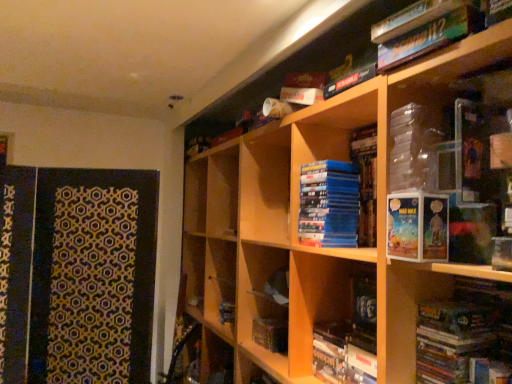
Question: Does wooden bookcase at upper right lie behind matte black book at lower right, placed as the 3th book when sorted from top to bottom?

Choices:
 (A) yes
 (B) no

Answer: (B)

Question: From a real-world perspective, is wooden bookcase at upper right on top of matte black book at lower right, placed as the 3th book when sorted from top to bottom?

Choices:
 (A) no
 (B) yes

Answer: (B)

Question: Could you tell me if wooden bookcase at upper right is turned towards matte black book at lower right, placed as the 3th book when sorted from top to bottom?

Choices:
 (A) no
 (B) yes

Answer: (B)

Question: Does wooden bookcase at upper right have a greater height compared to matte black book at lower right, which ranks as the second book in bottom-to-top order?

Choices:
 (A) yes
 (B) no

Answer: (A)

Question: Is wooden bookcase at upper right wider than matte black book at lower right, placed as the 3th book when sorted from top to bottom?

Choices:
 (A) yes
 (B) no

Answer: (A)

Question: From a real-world perspective, is wooden bookcase at upper right positioned above or below matte cardboard book at center-right?

Choices:
 (A) below
 (B) above

Answer: (A)

Question: Choose the correct answer: Is wooden bookcase at upper right inside matte cardboard book at center-right or outside it?

Choices:
 (A) outside
 (B) inside

Answer: (A)

Question: Based on their positions, is wooden bookcase at upper right located to the left or right of matte cardboard book at center-right?

Choices:
 (A) left
 (B) right

Answer: (A)

Question: In the image, is wooden bookcase at upper right positioned in front of or behind matte cardboard book at center-right?

Choices:
 (A) front
 (B) behind

Answer: (A)

Question: Considering the positions of green cardboard book at upper right, acting as the 4th book starting from the bottom, and wooden bookcase at upper right in the image, is green cardboard book at upper right, acting as the 4th book starting from the bottom, taller or shorter than wooden bookcase at upper right?

Choices:
 (A) tall
 (B) short

Answer: (B)

Question: Looking at the image, does green cardboard book at upper right, acting as the 4th book starting from the bottom, seem bigger or smaller compared to wooden bookcase at upper right?

Choices:
 (A) small
 (B) big

Answer: (A)

Question: Which is correct: green cardboard book at upper right, acting as the 4th book starting from the bottom, is inside wooden bookcase at upper right, or outside of it?

Choices:
 (A) inside
 (B) outside

Answer: (B)

Question: In the image, is green cardboard book at upper right, acting as the first book starting from the top, on the left side or the right side of wooden bookcase at upper right?

Choices:
 (A) right
 (B) left

Answer: (A)

Question: From their relative heights in the image, would you say matte cardboard book at center-right is taller or shorter than matte blue book at lower center, which is the fourth book in top-to-bottom order?

Choices:
 (A) short
 (B) tall

Answer: (A)

Question: Considering their positions, is matte cardboard book at center-right located in front of or behind matte blue book at lower center, the 1th book positioned from the bottom?

Choices:
 (A) behind
 (B) front

Answer: (B)